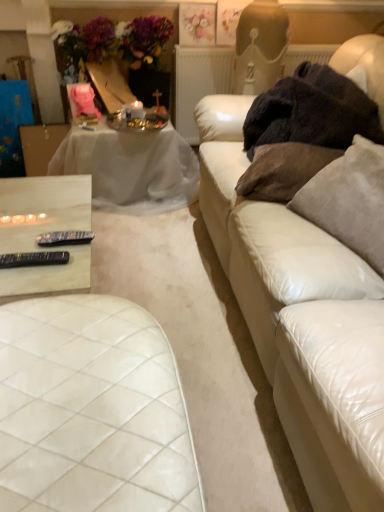
This screenshot has width=384, height=512. In order to click on vacant region to the right of black plastic remote control at lower left, arranged as the 2th tableware when viewed from the top in this screenshot , I will do `click(64, 277)`.